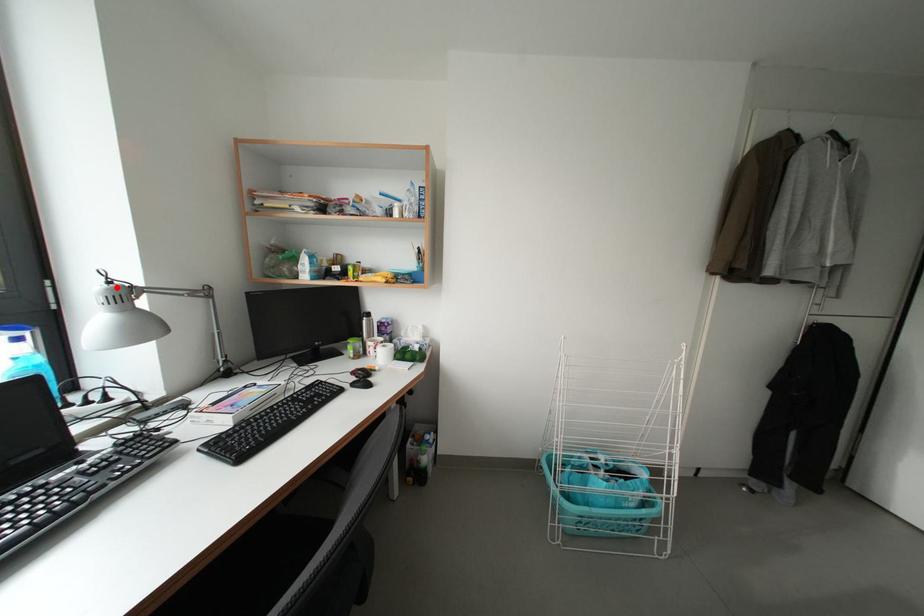
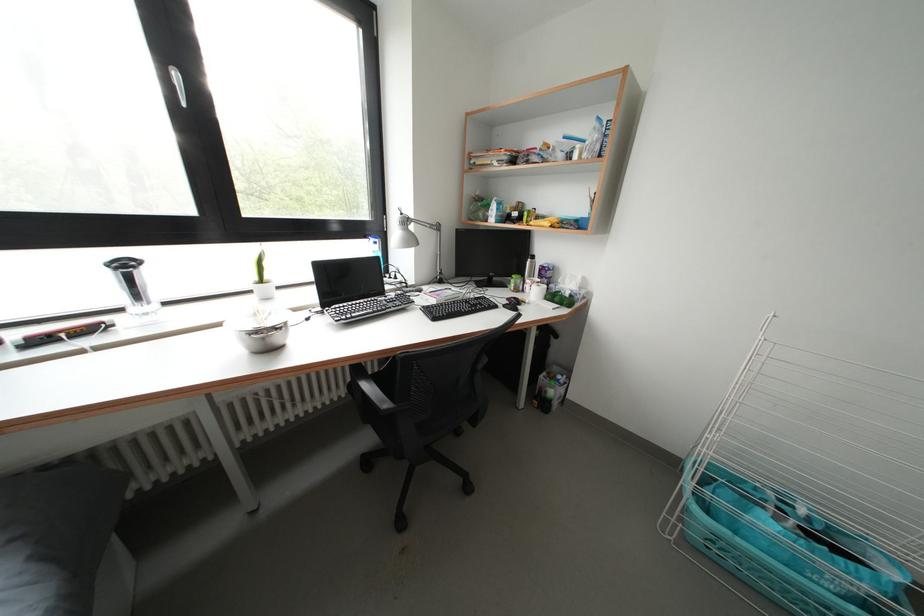
Question: A red point is marked in image1. In image2, is the corresponding 3D point closer to the camera or farther? Reply with the corresponding letter.

Choices:
 (A) The corresponding 3D point is closer.
 (B) The corresponding 3D point is farther.

Answer: (A)